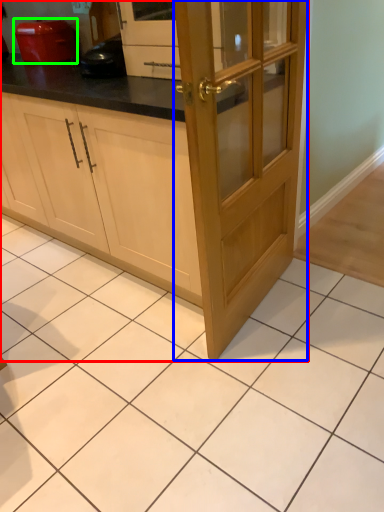
Question: Which object is positioned closest to cabinetry (highlighted by a red box)? Select from door (highlighted by a blue box) and home appliance (highlighted by a green box).

Choices:
 (A) door
 (B) home appliance

Answer: (A)